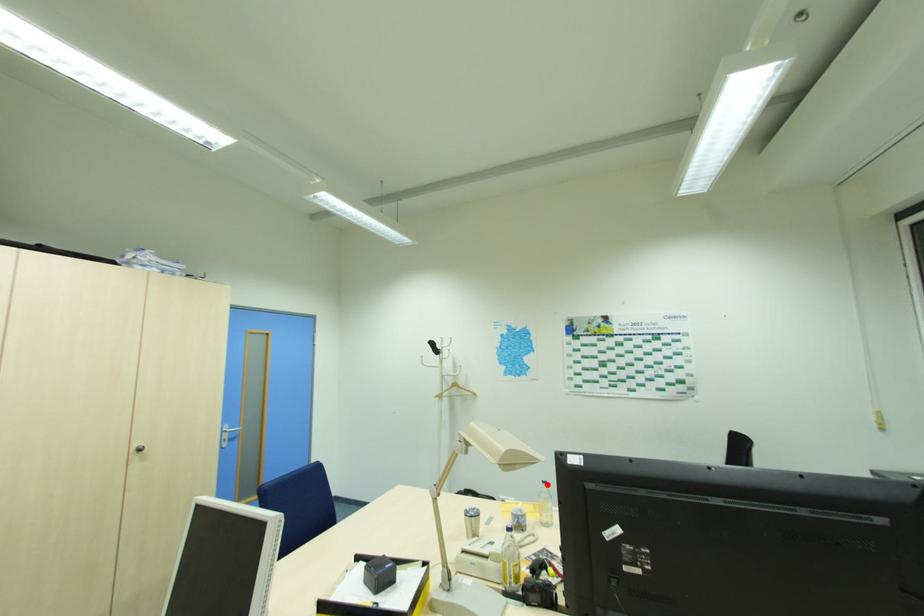
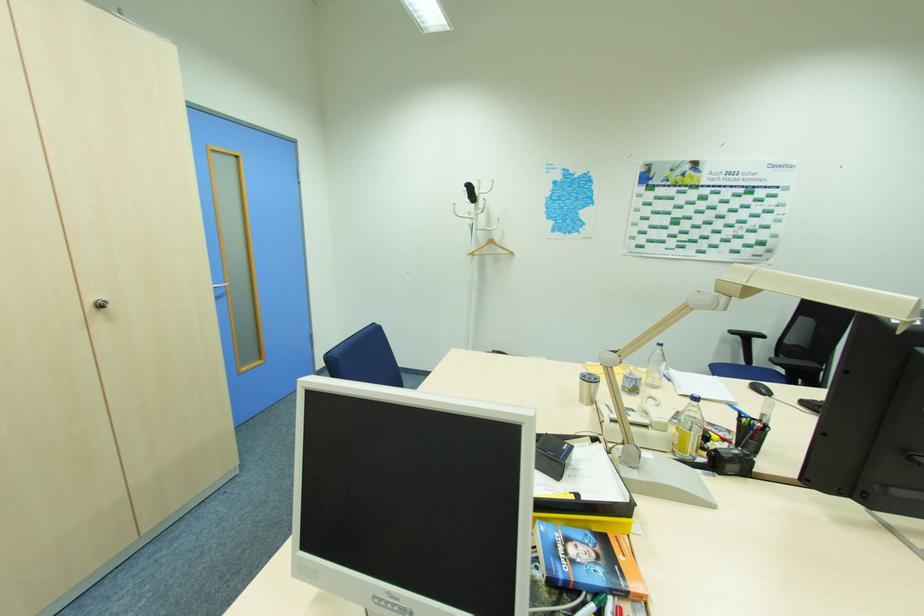
Locate, in the second image, the point that corresponds to the highlighted location in the first image.

(663, 347)